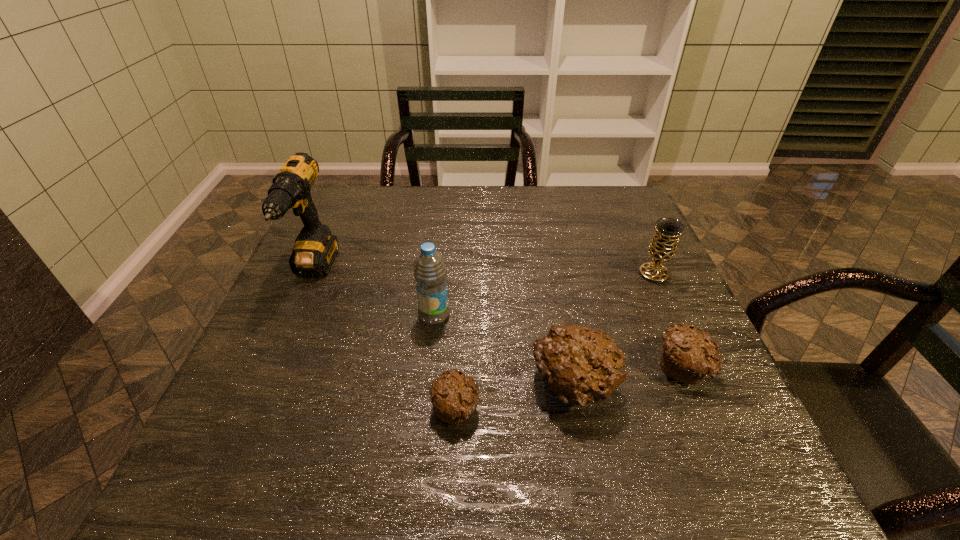
The width and height of the screenshot is (960, 540). I want to click on blank space that satisfies the following two spatial constraints: 1. at the tip of the tallest muffin; 2. on the right side of the drill, so click(263, 386).

Identify the location of free location that satisfies the following two spatial constraints: 1. on the back side of the second tallest object; 2. on the left side of the chalice. This screenshot has width=960, height=540. (439, 274).

I want to click on vacant space that satisfies the following two spatial constraints: 1. at the tip of the chalice; 2. on the left side of the leftmost object, so pos(313,274).